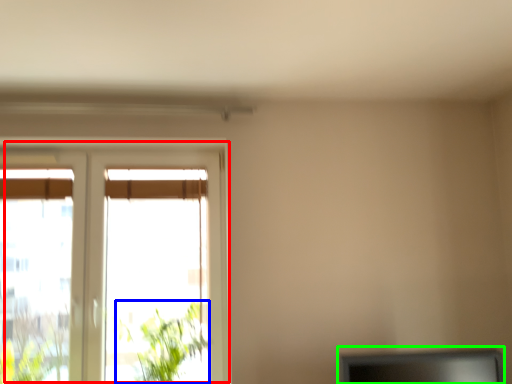
Question: Which object is positioned closest to window (highlighted by a red box)? Select from plant (highlighted by a blue box) and computer monitor (highlighted by a green box).

Choices:
 (A) plant
 (B) computer monitor

Answer: (A)